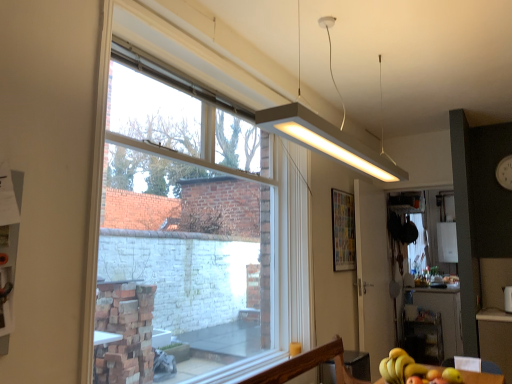
Question: Is yellow matte bananas at lower right positioned before clear glass window at center?

Choices:
 (A) yes
 (B) no

Answer: (B)

Question: Does yellow matte bananas at lower right have a lesser width compared to clear glass window at center?

Choices:
 (A) yes
 (B) no

Answer: (A)

Question: From a real-world perspective, is yellow matte bananas at lower right physically below clear glass window at center?

Choices:
 (A) no
 (B) yes

Answer: (B)

Question: Are yellow matte bananas at lower right and clear glass window at center located far from each other?

Choices:
 (A) no
 (B) yes

Answer: (B)

Question: Is clear glass window at center located within yellow matte bananas at lower right?

Choices:
 (A) no
 (B) yes

Answer: (A)

Question: From their relative heights in the image, would you say wooden table at lower right, which appears as the first table when viewed from the top, is taller or shorter than yellow matte bananas at lower right?

Choices:
 (A) short
 (B) tall

Answer: (A)

Question: In the image, is wooden table at lower right, placed as the first table when sorted from front to back, positioned in front of or behind yellow matte bananas at lower right?

Choices:
 (A) front
 (B) behind

Answer: (A)

Question: Would you say wooden table at lower right, the 1th table viewed from the left, is inside or outside yellow matte bananas at lower right?

Choices:
 (A) inside
 (B) outside

Answer: (B)

Question: In terms of size, does wooden table at lower right, placed as the first table when sorted from front to back, appear bigger or smaller than yellow matte bananas at lower right?

Choices:
 (A) small
 (B) big

Answer: (B)

Question: Is yellow matte bananas at lower right in front of or behind green matte apple at lower right in the image?

Choices:
 (A) behind
 (B) front

Answer: (A)

Question: From a real-world perspective, is yellow matte bananas at lower right positioned above or below green matte apple at lower right?

Choices:
 (A) below
 (B) above

Answer: (B)

Question: From their relative heights in the image, would you say yellow matte bananas at lower right is taller or shorter than green matte apple at lower right?

Choices:
 (A) short
 (B) tall

Answer: (B)

Question: Considering the positions of yellow matte bananas at lower right and green matte apple at lower right in the image, is yellow matte bananas at lower right wider or thinner than green matte apple at lower right?

Choices:
 (A) wide
 (B) thin

Answer: (A)

Question: From the image's perspective, relative to white matte rectangular light fixture at upper center, is yellow matte bananas at lower right above or below?

Choices:
 (A) above
 (B) below

Answer: (B)

Question: Is point (384, 370) closer or farther from the camera than point (358, 168)?

Choices:
 (A) closer
 (B) farther

Answer: (A)